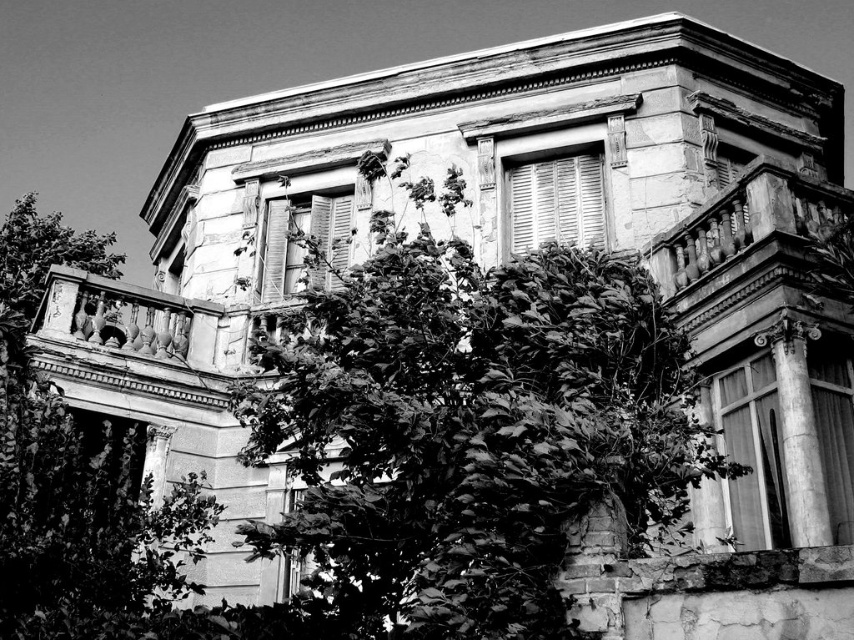
Question: Can you confirm if dark green leafy tree at center is bigger than leaves green textured tree at left?

Choices:
 (A) yes
 (B) no

Answer: (B)

Question: Which point is closer to the camera?

Choices:
 (A) dark green leafy tree at center
 (B) leaves green textured tree at left

Answer: (A)

Question: Which point appears farthest from the camera in this image?

Choices:
 (A) (412, 486)
 (B) (45, 570)

Answer: (B)

Question: Which point appears farthest from the camera in this image?

Choices:
 (A) (259, 435)
 (B) (12, 428)

Answer: (A)

Question: Can you confirm if dark green leafy tree at center is smaller than leaves green textured tree at left?

Choices:
 (A) yes
 (B) no

Answer: (A)

Question: Can you confirm if dark green leafy tree at center is thinner than leaves green textured tree at left?

Choices:
 (A) yes
 (B) no

Answer: (A)